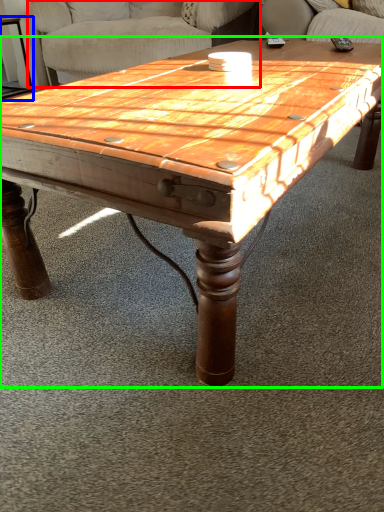
Question: Which object is positioned closest to swivel chair (highlighted by a red box)? Select from side table (highlighted by a blue box) and coffee table (highlighted by a green box).

Choices:
 (A) side table
 (B) coffee table

Answer: (A)